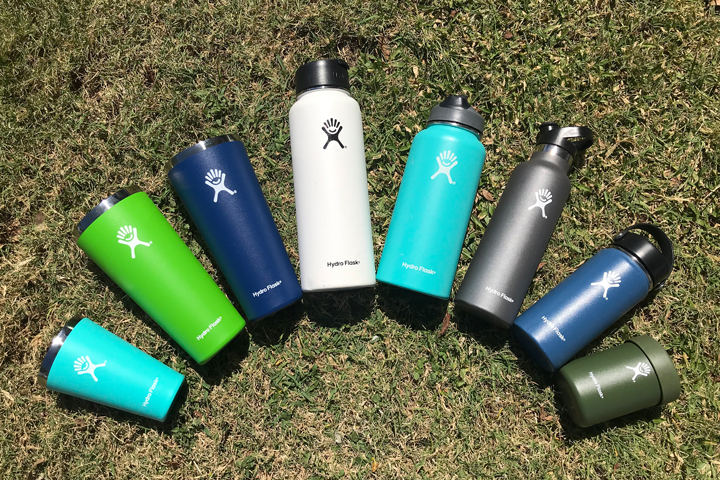
In order to click on containers with lids in this screenshot , I will do `click(634, 369)`, `click(580, 296)`, `click(502, 245)`, `click(438, 227)`, `click(332, 222)`.